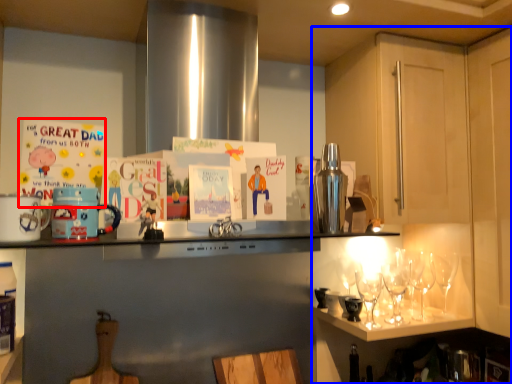
Question: Which point is further to the camera, postcard (highlighted by a red box) or cabinetry (highlighted by a blue box)?

Choices:
 (A) postcard
 (B) cabinetry

Answer: (A)